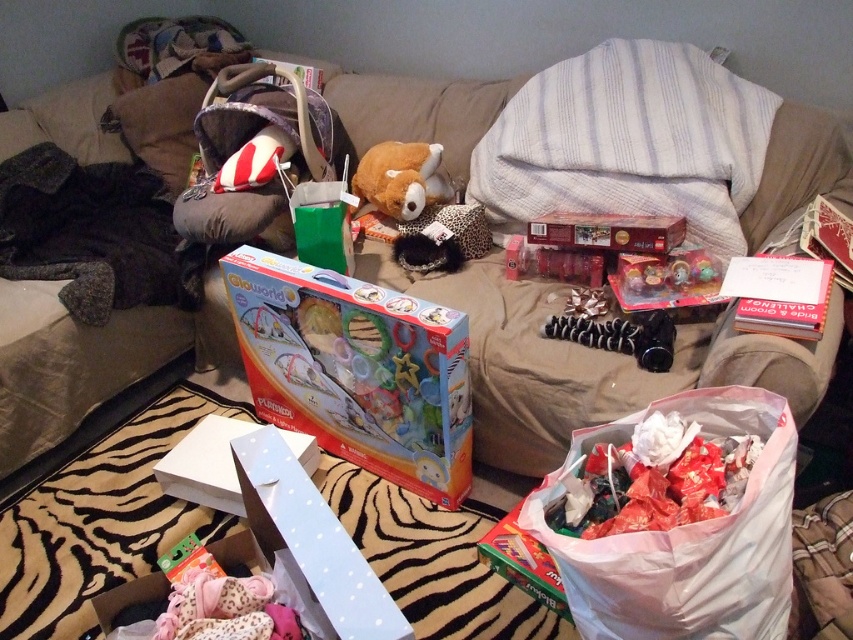
Can you confirm if velvety brown pillow at upper left is positioned below matte red plastic lego box at center?

Incorrect, velvety brown pillow at upper left is not positioned below matte red plastic lego box at center.

Is velvety brown pillow at upper left positioned in front of matte red plastic lego box at center?

No, velvety brown pillow at upper left is further to the viewer.

At what (x,y) coordinates should I click in order to perform the action: click on velvety brown pillow at upper left. Please return your answer as a coordinate pair (x, y). Looking at the image, I should click on (160, 124).

Identify the location of multicolored cardboard box at center. (357, 369).

Between multicolored cardboard box at center and translucent plastic toy at center, which one has more height?

multicolored cardboard box at center

Identify the location of multicolored cardboard box at center. (357, 369).

Find the location of a particular element. multicolored cardboard box at center is located at coordinates (357, 369).

Which is below, matte red plastic lego box at center or white paper at upper right?

white paper at upper right is lower down.

Does matte red plastic lego box at center have a lesser width compared to white paper at upper right?

No.

The image size is (853, 640). I want to click on matte red plastic lego box at center, so click(607, 230).